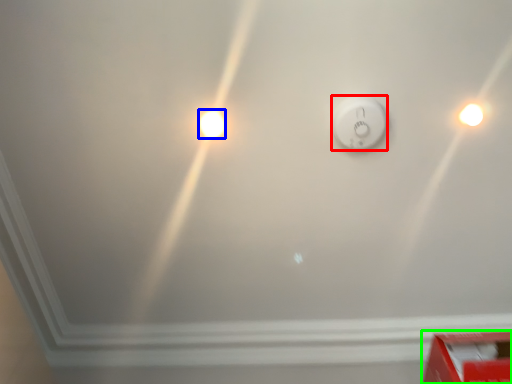
Question: Based on their relative distances, which object is nearer to power plugs and sockets (highlighted by a red box)? Choose from light bulb (highlighted by a blue box) and box (highlighted by a green box).

Choices:
 (A) light bulb
 (B) box

Answer: (A)